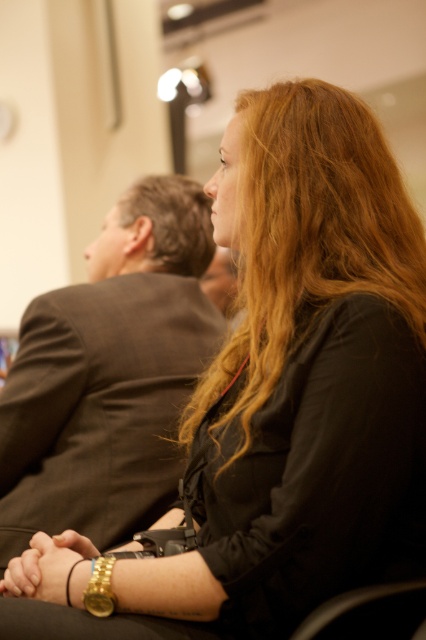
Consider the image. Who is positioned more to the right, blonde hair at center or gold metallic bracelet at lower center?

blonde hair at center

Is blonde hair at center positioned in front of gold metallic bracelet at lower center?

That is False.

Is point (307, 289) positioned before point (108, 563)?

That is False.

Find the location of a particular element. Image resolution: width=426 pixels, height=640 pixels. blonde hair at center is located at coordinates (307, 236).

Does dark brown suit at center have a greater width compared to blonde hair at center?

Yes.

Between dark brown suit at center and blonde hair at center, which one has less height?

Standing shorter between the two is blonde hair at center.

Is point (54, 488) positioned behind point (284, 122)?

That is True.

The image size is (426, 640). Identify the location of dark brown suit at center. (109, 374).

Which is more to the left, brownhair at left or gold metallic bracelet at center?

gold metallic bracelet at center

Which is more to the right, brownhair at left or gold metallic bracelet at center?

From the viewer's perspective, brownhair at left appears more on the right side.

Locate an element on the screen. The image size is (426, 640). brownhair at left is located at coordinates coord(172,221).

Where is `brownhair at left`? The height and width of the screenshot is (640, 426). brownhair at left is located at coordinates (172, 221).